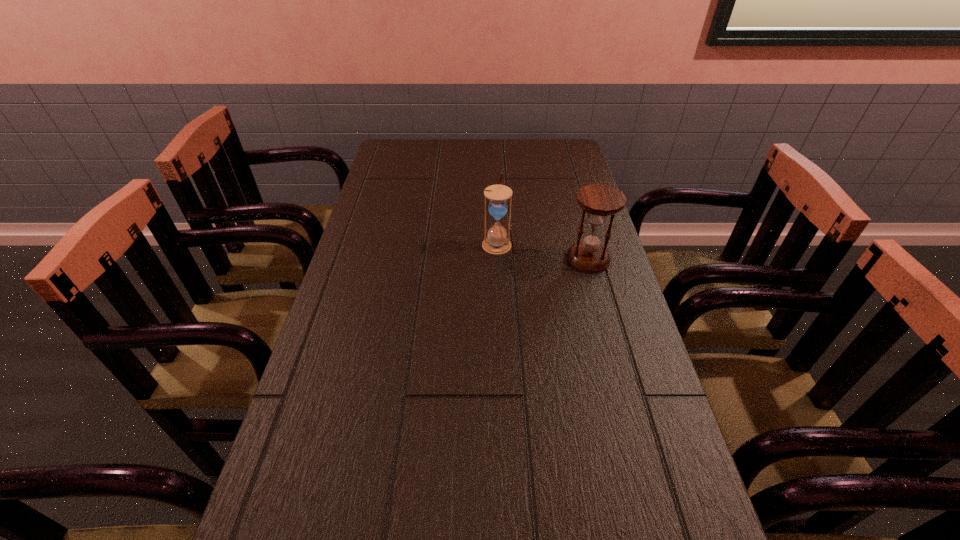
This screenshot has height=540, width=960. Find the location of `the left hourglass`. the left hourglass is located at coordinates (496, 242).

You are a GUI agent. You are given a task and a screenshot of the screen. Output one action in this format:
    pyautogui.click(x=<x>, y=<y>)
    Task: Click on the right hourglass
    The width and height of the screenshot is (960, 540).
    Given the screenshot: What is the action you would take?
    pyautogui.click(x=599, y=200)

I want to click on vacant position located on the front of the left hourglass, so click(501, 341).

Identify the location of blank space located on the front of the right object. This screenshot has width=960, height=540. (612, 347).

Image resolution: width=960 pixels, height=540 pixels. I want to click on object that is at the right edge, so pos(599,200).

This screenshot has width=960, height=540. Identify the location of vacant area at the far edge. (460, 140).

Find the location of a particular element. This screenshot has height=540, width=960. vacant space at the left edge of the desktop is located at coordinates (339, 501).

Image resolution: width=960 pixels, height=540 pixels. I want to click on vacant space at the right edge of the desktop, so click(552, 172).

Locate an element on the screen. The height and width of the screenshot is (540, 960). vacant space at the far right corner of the desktop is located at coordinates (556, 163).

This screenshot has height=540, width=960. I want to click on unoccupied area between the left hourglass and the right hourglass, so click(x=542, y=251).